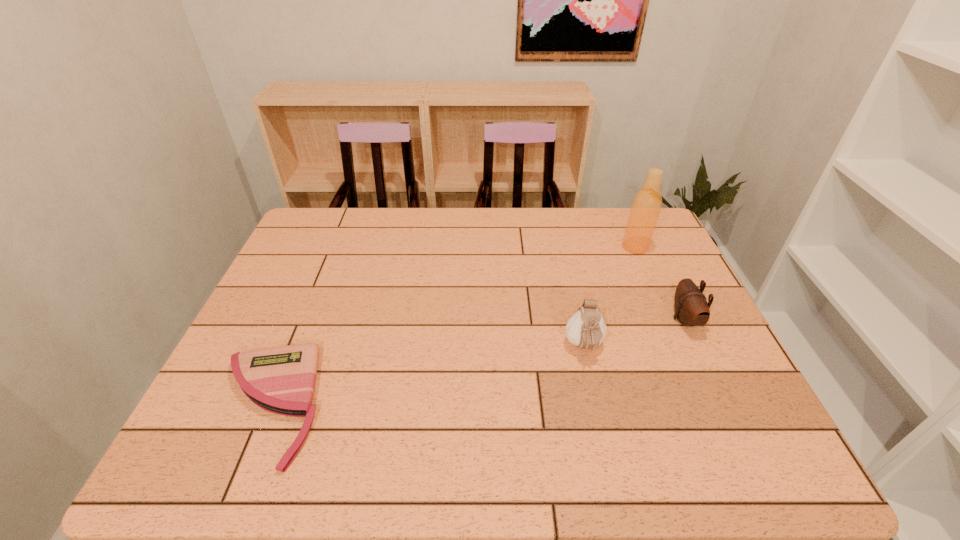
Where is `blank area located 0.150m with the flap open on the shorter pouch`? This screenshot has width=960, height=540. blank area located 0.150m with the flap open on the shorter pouch is located at coordinates (615, 319).

Find the location of a particular element. Image resolution: width=960 pixels, height=540 pixels. blank area located 0.170m with the flap open on the shorter pouch is located at coordinates (608, 319).

Image resolution: width=960 pixels, height=540 pixels. I want to click on vacant space located 0.120m on the right of the shortest object, so click(x=376, y=405).

This screenshot has height=540, width=960. What are the coordinates of `object that is at the far edge` in the screenshot? It's located at (646, 206).

Image resolution: width=960 pixels, height=540 pixels. Find the location of `object at the near edge`. object at the near edge is located at coordinates (281, 380).

The width and height of the screenshot is (960, 540). Find the location of `object that is at the left edge`. object that is at the left edge is located at coordinates (281, 380).

Identify the location of beer bottle present at the right edge. The width and height of the screenshot is (960, 540). coord(646,206).

Where is `pouch at the right edge`? pouch at the right edge is located at coordinates click(691, 308).

This screenshot has width=960, height=540. In order to click on object that is at the near left corner in this screenshot , I will do `click(281, 380)`.

Locate an element on the screen. The width and height of the screenshot is (960, 540). object situated at the far right corner is located at coordinates 646,206.